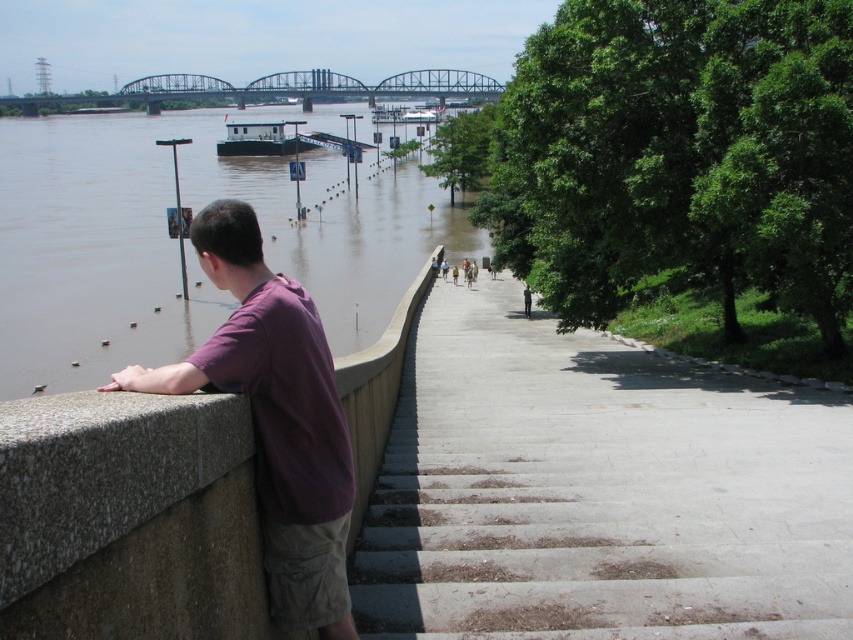
Question: Does brown muddy water at left appear on the right side of purple cotton shirt at left?

Choices:
 (A) no
 (B) yes

Answer: (A)

Question: Is brown muddy water at left thinner than white matte barge at center?

Choices:
 (A) no
 (B) yes

Answer: (A)

Question: Which object is closer to the camera taking this photo?

Choices:
 (A) purple cotton shirt at left
 (B) brown muddy water at left
 (C) brushed metal bridge at upper center
 (D) white matte barge at center

Answer: (A)

Question: Which point appears closest to the camera in this image?

Choices:
 (A) (142, 80)
 (B) (137, 326)
 (C) (293, 145)
 (D) (351, 634)

Answer: (D)

Question: Which is nearer to the white matte barge at center?

Choices:
 (A) purple cotton shirt at left
 (B) brown muddy water at left
 (C) brushed metal bridge at upper center

Answer: (B)

Question: Does brown muddy water at left have a lesser width compared to purple cotton shirt at left?

Choices:
 (A) no
 (B) yes

Answer: (A)